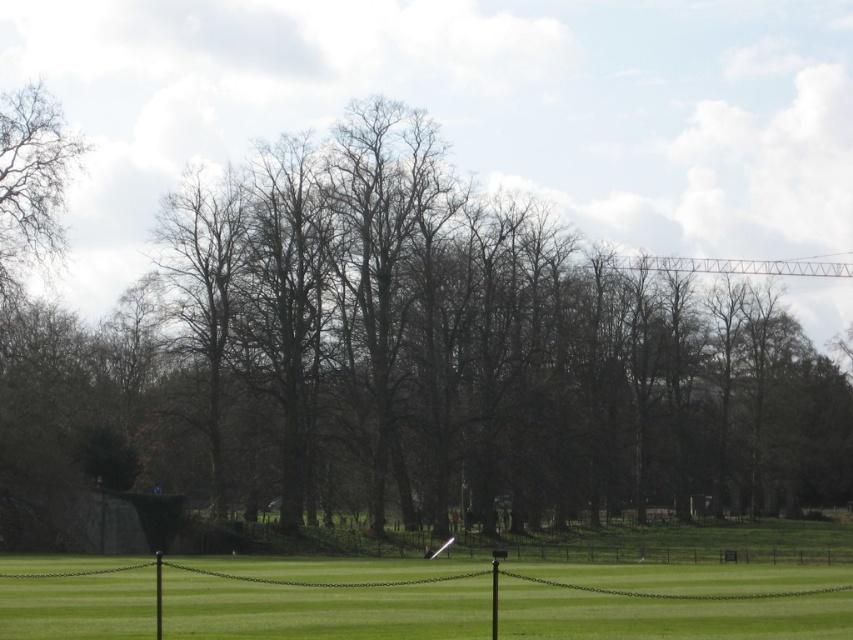
Question: Which object is positioned farthest from the bare branches at left?

Choices:
 (A) green grass at center
 (B) brown leafless tree at center

Answer: (B)

Question: Observing the image, what is the correct spatial positioning of brown leafless tree at center in reference to bare branches at left?

Choices:
 (A) below
 (B) above

Answer: (A)

Question: From the image, what is the correct spatial relationship of green grass at center in relation to bare branches at left?

Choices:
 (A) below
 (B) above

Answer: (A)

Question: Which of the following is the closest to the observer?

Choices:
 (A) brown leafless tree at center
 (B) green grass at center
 (C) bare branches at left

Answer: (B)

Question: Among these objects, which one is farthest from the camera?

Choices:
 (A) brown leafless tree at center
 (B) bare branches at left

Answer: (B)

Question: Is brown leafless tree at center below green grass at center?

Choices:
 (A) yes
 (B) no

Answer: (B)